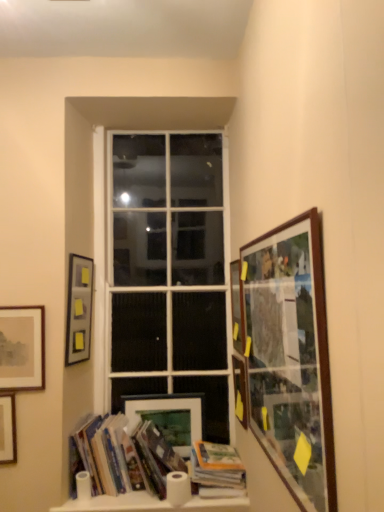
Question: Is point (79, 355) positioned closer to the camera than point (244, 374)?

Choices:
 (A) farther
 (B) closer

Answer: (A)

Question: From their relative heights in the image, would you say matte black picture frame at lower left, acting as the third picture frame starting from the left, is taller or shorter than matte glass picture frame at right, acting as the second picture frame starting from the right?

Choices:
 (A) short
 (B) tall

Answer: (B)

Question: Based on their relative distances, which object is farther from the matte wooden picture frame at lower center, acting as the 4th picture frame starting from the left?

Choices:
 (A) matte brown picture frame at left, which is counted as the 2th picture frame, starting from the left
 (B) matte black picture frame at lower left, which ranks as the 5th picture frame in right-to-left order
 (C) wooden-framed collage at right, the 1th picture frame when ordered from right to left
 (D) hardcover books at lower left, which is the first book from left to right
 (E) white glass window at center

Answer: (C)

Question: Which object is the farthest from the matte black picture frame at lower left, acting as the third picture frame starting from the left?

Choices:
 (A) wooden picture frame at right, the fifth picture frame positioned from the left
 (B) matte wooden picture frame at lower center, acting as the 4th picture frame starting from the right
 (C) matte brown picture frame at left, which is counted as the 2th picture frame, starting from the left
 (D) hardcover books at lower left, which is the first book from left to right
 (E) wooden picture frame at lower left, the 1th picture frame from the left

Answer: (A)